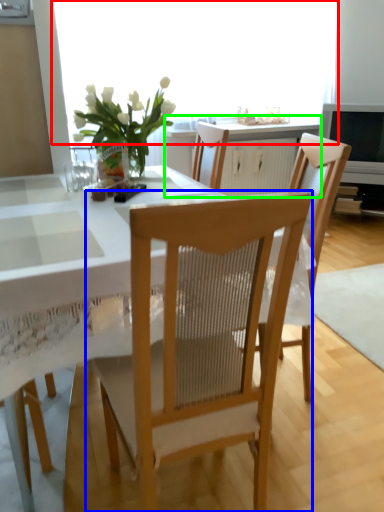
Question: Which object is positioned farthest from window screen (highlighted by a red box)? Select from chair (highlighted by a blue box) and cabinetry (highlighted by a green box).

Choices:
 (A) chair
 (B) cabinetry

Answer: (A)